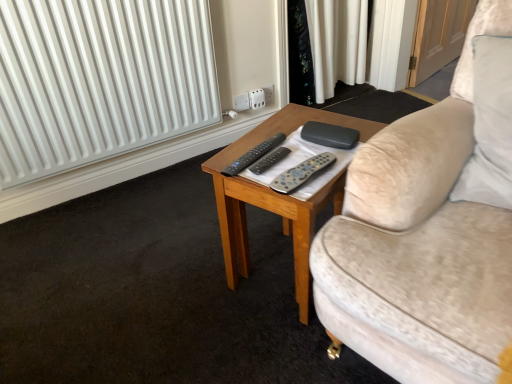
Question: From the image's perspective, relative to black matte remote control at center, which appears as the first remote control when viewed from the left, is gray matte remote control at center, the 1th remote control viewed from the right, above or below?

Choices:
 (A) above
 (B) below

Answer: (B)

Question: From their relative heights in the image, would you say gray matte remote control at center, the 1th remote control viewed from the right, is taller or shorter than black matte remote control at center, which appears as the first remote control when viewed from the left?

Choices:
 (A) tall
 (B) short

Answer: (A)

Question: Which of these objects is positioned closest to the white plastic socket at upper center?

Choices:
 (A) gray matte remote control at center, placed as the 3th remote control when sorted from left to right
 (B) black matte case at center
 (C) black matte remote control at center, which appears as the first remote control when viewed from the left
 (D) wooden coffee table at center
 (E) black plastic remote control at center, arranged as the 2th remote control when viewed from the left

Answer: (B)

Question: Which object is the closest to the wooden coffee table at center?

Choices:
 (A) black matte case at center
 (B) black plastic remote control at center, arranged as the 2th remote control when viewed from the left
 (C) black matte remote control at center, which appears as the first remote control when viewed from the left
 (D) gray matte remote control at center, the 1th remote control viewed from the right
 (E) white plastic socket at upper center

Answer: (C)